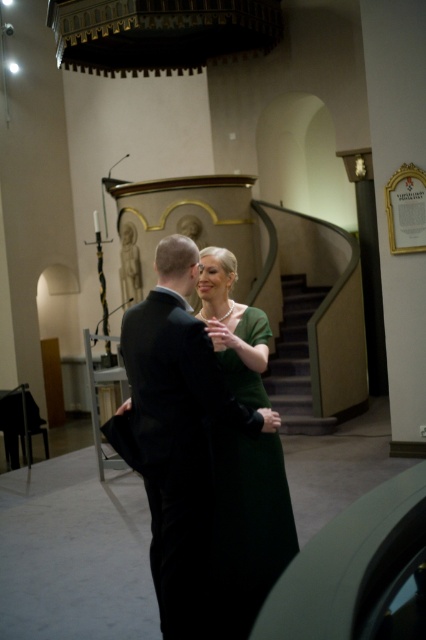
Is black velvet suit at center to the right of green matte dress at center from the viewer's perspective?

No, black velvet suit at center is not to the right of green matte dress at center.

Which is in front, point (173, 292) or point (256, 444)?

Point (173, 292) is more forward.

Where is `black velvet suit at center`? The width and height of the screenshot is (426, 640). black velvet suit at center is located at coordinates (175, 433).

Which is below, black velvet suit at center or wooden staircase at center?

black velvet suit at center is lower down.

Identify the location of black velvet suit at center. The image size is (426, 640). (175, 433).

Who is more forward, (210,508) or (299,394)?

Point (210,508) is in front.

Locate an element on the screen. black velvet suit at center is located at coordinates (175, 433).

Who is more distant from viewer, (279, 524) or (307, 394)?

Point (307, 394)

What do you see at coordinates (247, 529) in the screenshot? The width and height of the screenshot is (426, 640). I see `green matte dress at center` at bounding box center [247, 529].

You are a GUI agent. You are given a task and a screenshot of the screen. Output one action in this format:
    pyautogui.click(x=<x>, y=<y>)
    Task: Click on the green matte dress at center
    
    Given the screenshot: What is the action you would take?
    pyautogui.click(x=247, y=529)